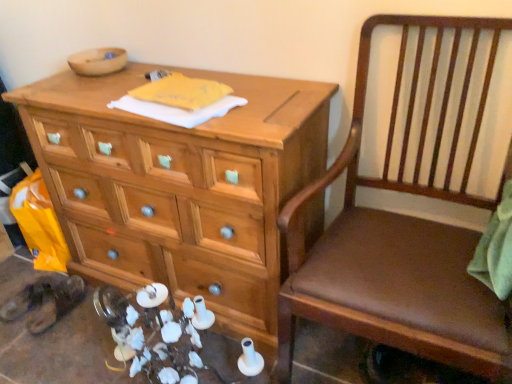
Question: Is brown wood chair at right smaller than natural wood chest of drawers at center?

Choices:
 (A) no
 (B) yes

Answer: (B)

Question: Is brown wood chair at right to the right of natural wood chest of drawers at center from the viewer's perspective?

Choices:
 (A) no
 (B) yes

Answer: (B)

Question: Could you tell me if brown wood chair at right is turned towards natural wood chest of drawers at center?

Choices:
 (A) no
 (B) yes

Answer: (A)

Question: Is brown wood chair at right wider than natural wood chest of drawers at center?

Choices:
 (A) no
 (B) yes

Answer: (B)

Question: Is brown wood chair at right not near natural wood chest of drawers at center?

Choices:
 (A) no
 (B) yes

Answer: (A)

Question: Is the surface of brown wood chair at right in direct contact with natural wood chest of drawers at center?

Choices:
 (A) no
 (B) yes

Answer: (A)

Question: Does natural wood chest of drawers at center appear on the right side of brown wood chair at right?

Choices:
 (A) no
 (B) yes

Answer: (A)

Question: Can you confirm if natural wood chest of drawers at center is shorter than brown wood chair at right?

Choices:
 (A) yes
 (B) no

Answer: (A)

Question: Considering the relative sizes of natural wood chest of drawers at center and brown wood chair at right in the image provided, is natural wood chest of drawers at center bigger than brown wood chair at right?

Choices:
 (A) yes
 (B) no

Answer: (A)

Question: From a real-world perspective, is natural wood chest of drawers at center physically below brown wood chair at right?

Choices:
 (A) yes
 (B) no

Answer: (A)

Question: Does natural wood chest of drawers at center have a smaller size compared to brown wood chair at right?

Choices:
 (A) no
 (B) yes

Answer: (A)

Question: Is natural wood chest of drawers at center positioned far away from brown wood chair at right?

Choices:
 (A) no
 (B) yes

Answer: (A)

Question: Based on their positions, is natural wood chest of drawers at center located to the left or right of brown wood chair at right?

Choices:
 (A) left
 (B) right

Answer: (A)